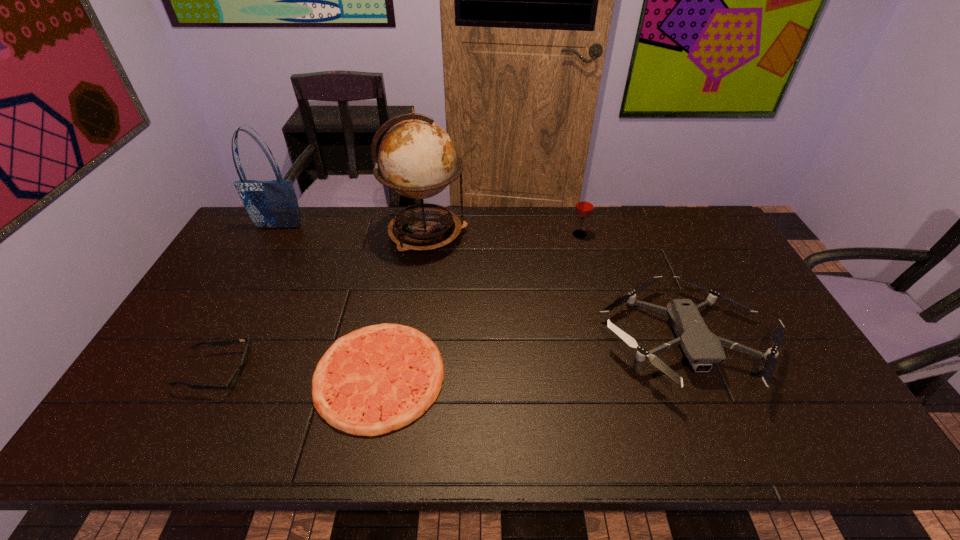
Identify the location of free space between the second shortest object and the glass. Image resolution: width=960 pixels, height=540 pixels. (398, 303).

Find the location of a particular element. This screenshot has width=960, height=540. empty space between the fifth tallest object and the fourth tallest object is located at coordinates (450, 357).

The image size is (960, 540). Identify the location of vacant space that's between the fifth shortest object and the second shortest object. (248, 300).

Image resolution: width=960 pixels, height=540 pixels. Find the location of `object that is the fifth nearest to the shopping bag`. object that is the fifth nearest to the shopping bag is located at coordinates (702, 348).

Choose which object is the third nearest neighbor to the sunglasses. Please provide its 2D coordinates. Your answer should be formatted as a tuple, i.e. [(x, y)], where the tuple contains the x and y coordinates of a point satisfying the conditions above.

[(270, 204)]

At what (x,y) coordinates should I click in order to perform the action: click on blank area in the image that satisfies the following two spatial constraints: 1. on the front-facing side of the glass; 2. on the left side of the shopping bag. Please return your answer as a coordinate pair (x, y). The image size is (960, 540). Looking at the image, I should click on (276, 235).

This screenshot has width=960, height=540. Identify the location of free location that satisfies the following two spatial constraints: 1. on the front-facing side of the sunglasses; 2. on the right side of the shortest object. (214, 376).

Where is `vacant space that satisfies the following two spatial constraints: 1. on the front-facing side of the shortest object; 2. on the left side of the shopping bag`? This screenshot has height=540, width=960. vacant space that satisfies the following two spatial constraints: 1. on the front-facing side of the shortest object; 2. on the left side of the shopping bag is located at coordinates (197, 376).